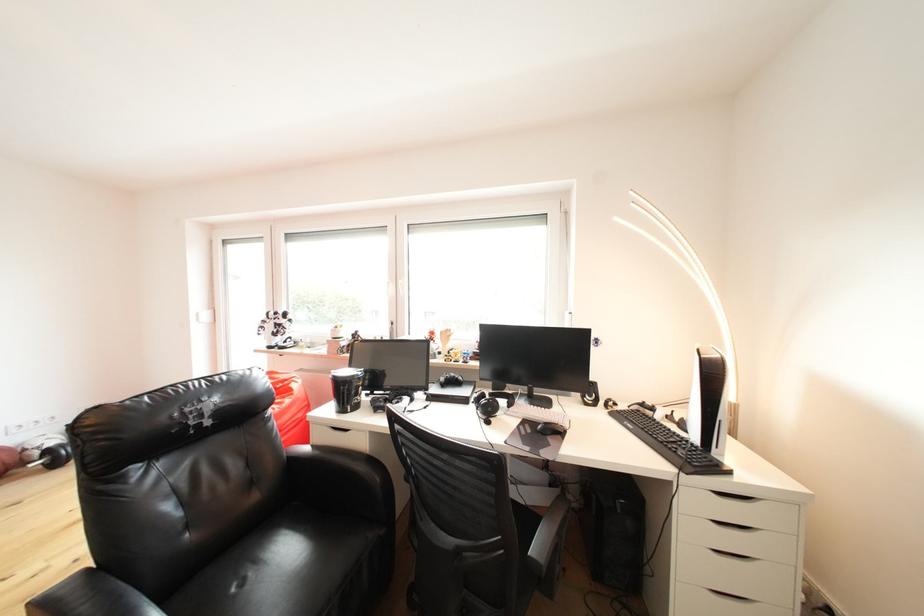
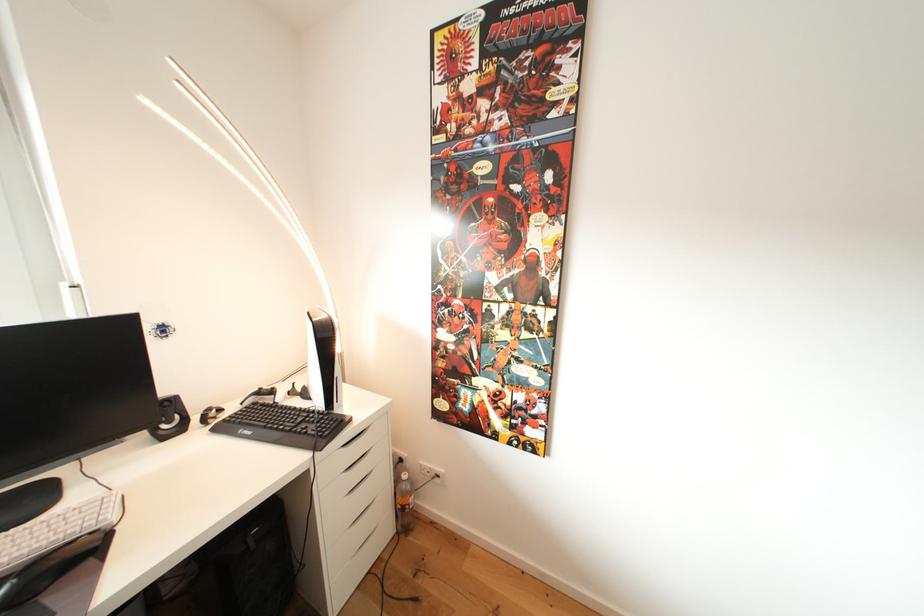
Question: I am providing you with two images of the same scene from different viewpoints. Please identify which objects are invisible in image2.

Choices:
 (A) black speaker
 (B) game controller
 (C) white drawer handle
 (D) none of these

Answer: (D)